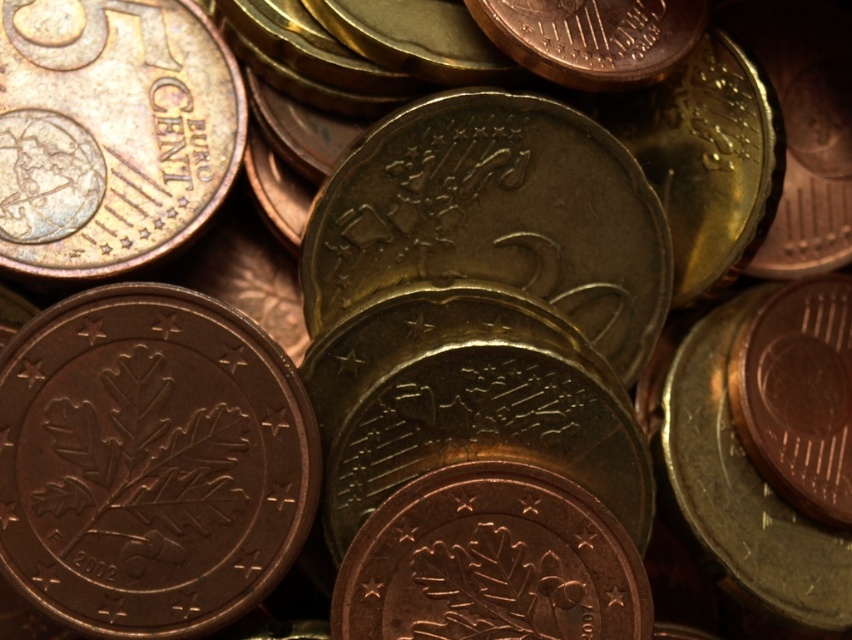
Question: Among these objects, which one is farthest from the camera?

Choices:
 (A) bronze metallic coin at lower left
 (B) brass metallic coin at upper left

Answer: (B)

Question: Is the position of bronze metallic coin at lower left more distant than that of brass metallic coin at upper left?

Choices:
 (A) yes
 (B) no

Answer: (B)

Question: Can you confirm if bronze metallic coin at lower left is bigger than brass metallic coin at upper left?

Choices:
 (A) no
 (B) yes

Answer: (A)

Question: Considering the relative positions of bronze metallic coin at lower left and brass metallic coin at upper left in the image provided, where is bronze metallic coin at lower left located with respect to brass metallic coin at upper left?

Choices:
 (A) right
 (B) left

Answer: (A)